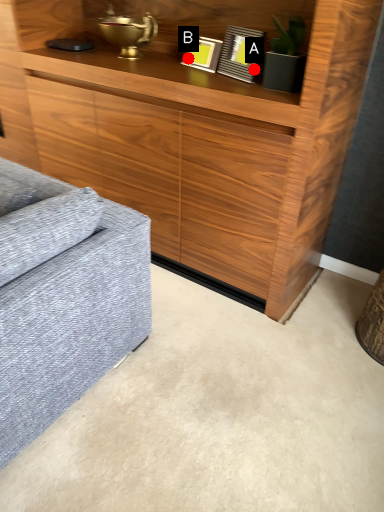
Question: Two points are circled on the image, labeled by A and B beside each circle. Which of the following is the farthest from the observer?

Choices:
 (A) A is further
 (B) B is further

Answer: (B)